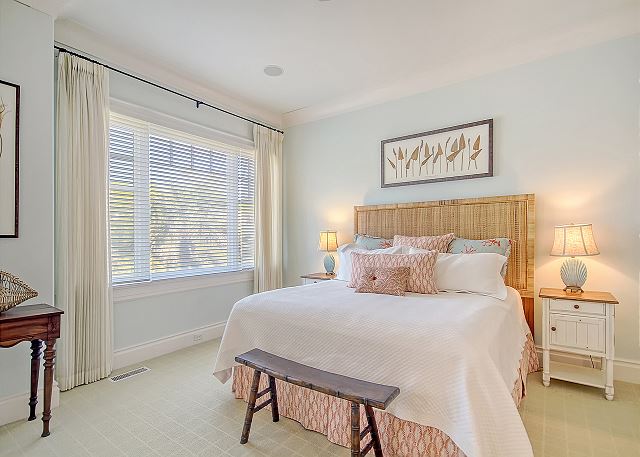
I want to click on bedroom furniture, so click(x=355, y=383), click(x=564, y=338), click(x=490, y=227), click(x=312, y=274), click(x=27, y=308), click(x=330, y=239), click(x=566, y=249).